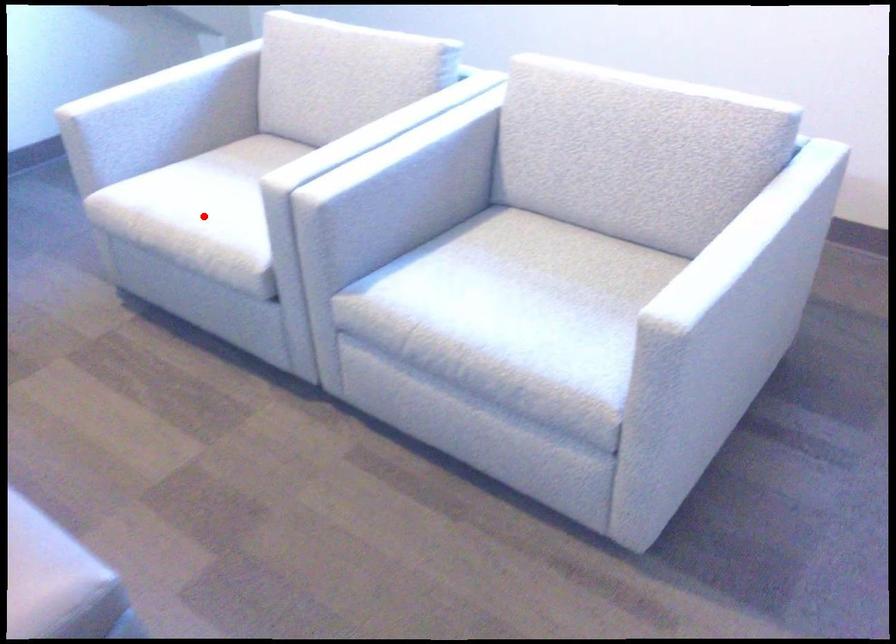
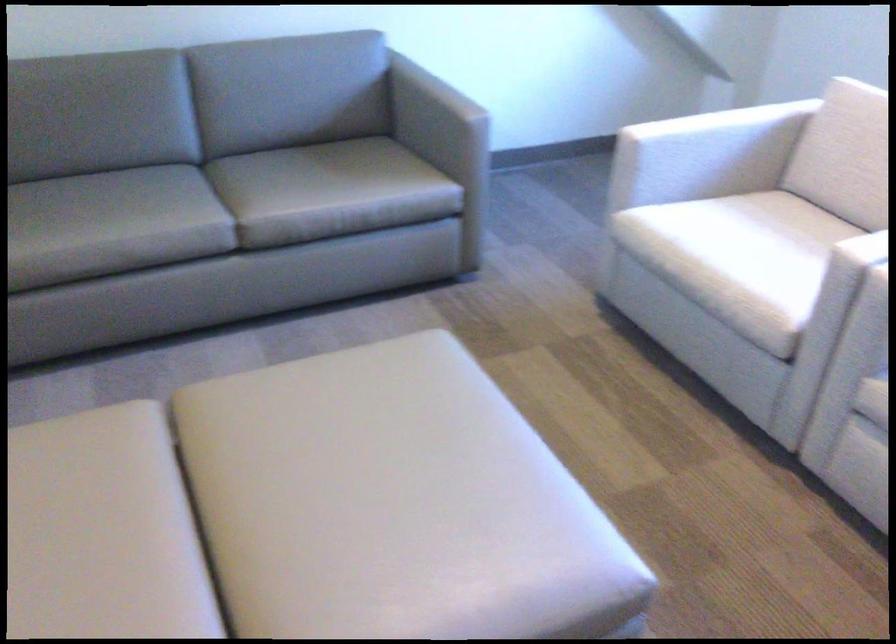
Where in the second image is the point corresponding to the highlighted location from the first image?

(737, 261)